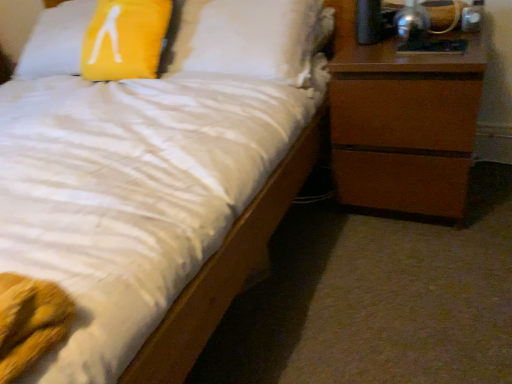
You are a GUI agent. You are given a task and a screenshot of the screen. Output one action in this format:
    pyautogui.click(x=<x>, y=<y>)
    Task: Click on the vacant area situated to the left side of metallic silver lamp at upper right
    This screenshot has height=384, width=512.
    Given the screenshot: What is the action you would take?
    pyautogui.click(x=374, y=44)